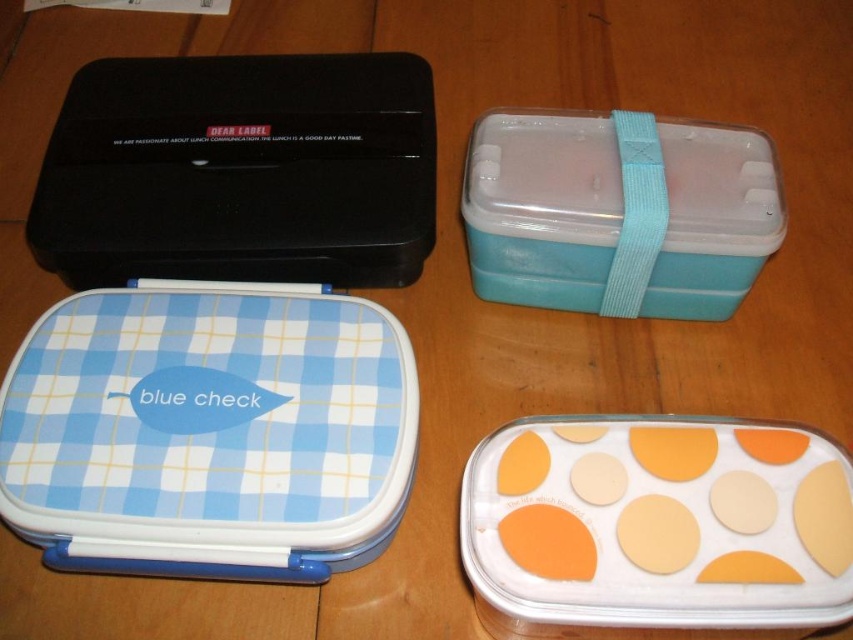
This screenshot has height=640, width=853. What do you see at coordinates (241, 170) in the screenshot? I see `black plastic lunch box at upper left` at bounding box center [241, 170].

Does black plastic lunch box at upper left have a larger size compared to matte orange and white plastic container at lower right?

Indeed, black plastic lunch box at upper left has a larger size compared to matte orange and white plastic container at lower right.

Is point (184, 257) positioned behind point (593, 589)?

Yes, point (184, 257) is farther from viewer.

Locate an element on the screen. This screenshot has height=640, width=853. black plastic lunch box at upper left is located at coordinates (241, 170).

Does black plastic lunch box at upper left appear on the left side of teal plastic lunchbox at upper right?

Correct, you'll find black plastic lunch box at upper left to the left of teal plastic lunchbox at upper right.

From the picture: Between black plastic lunch box at upper left and teal plastic lunchbox at upper right, which one appears on the right side from the viewer's perspective?

teal plastic lunchbox at upper right is more to the right.

Is point (148, 156) closer to viewer compared to point (659, 145)?

That is False.

Where is `black plastic lunch box at upper left`? This screenshot has width=853, height=640. black plastic lunch box at upper left is located at coordinates (241, 170).

Between point (474, 273) and point (556, 584), which one is positioned in front?

Point (556, 584) is in front.

Can you confirm if teal plastic lunchbox at upper right is positioned to the left of matte orange and white plastic container at lower right?

No, teal plastic lunchbox at upper right is not to the left of matte orange and white plastic container at lower right.

Identify the location of teal plastic lunchbox at upper right. The width and height of the screenshot is (853, 640). (618, 212).